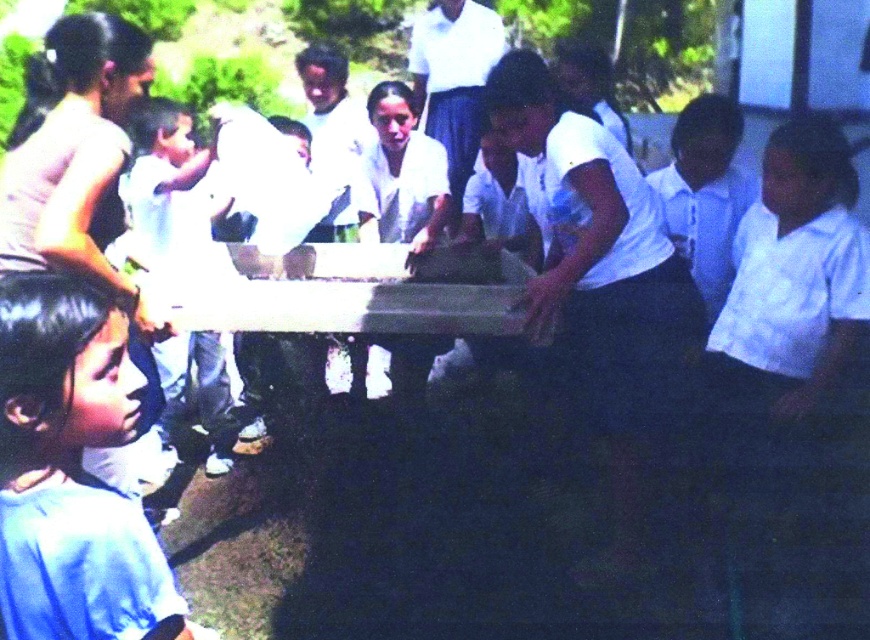
Is point (855, 224) positioned behind point (500, 218)?

No, it is not.

Is white cotton shirt at lower right closer to the viewer compared to white cotton shirt at center?

Yes, it is.

Where is `white cotton shirt at lower right`? white cotton shirt at lower right is located at coordinates 793,300.

Between blue cotton shirt at lower left and white cotton shirt at right, which one appears on the left side from the viewer's perspective?

blue cotton shirt at lower left is more to the left.

Locate an element on the screen. blue cotton shirt at lower left is located at coordinates (70, 474).

Between blue cotton shirt at lower left and white cotton shirt at center, which one is positioned higher?

white cotton shirt at center is higher up.

What are the coordinates of `blue cotton shirt at lower left` in the screenshot? It's located at (70, 474).

The image size is (870, 640). Find the location of `blue cotton shirt at lower left`. blue cotton shirt at lower left is located at coordinates (70, 474).